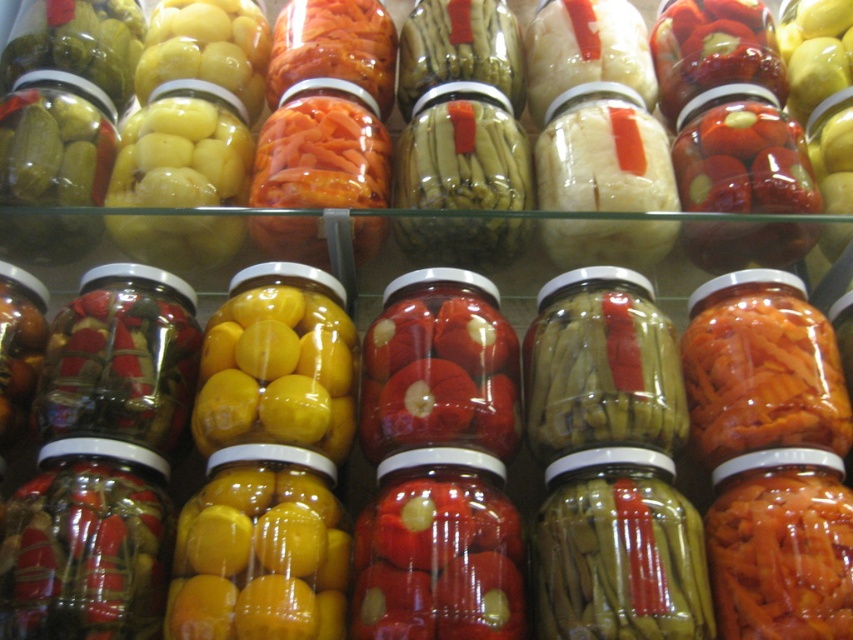
Question: Is green matte pickles at center above translucent glass jar at left?

Choices:
 (A) no
 (B) yes

Answer: (A)

Question: Which of the following is the closest to the observer?

Choices:
 (A) (167, 426)
 (B) (596, 451)

Answer: (B)

Question: Which point is closer to the camera taking this photo?

Choices:
 (A) (618, 486)
 (B) (144, 356)

Answer: (A)

Question: Considering the relative positions of green matte pickles at center and translucent glass jar at left in the image provided, where is green matte pickles at center located with respect to translucent glass jar at left?

Choices:
 (A) above
 (B) below

Answer: (B)

Question: Considering the relative positions of green matte pickles at center and translucent glass jar at left in the image provided, where is green matte pickles at center located with respect to translucent glass jar at left?

Choices:
 (A) left
 (B) right

Answer: (B)